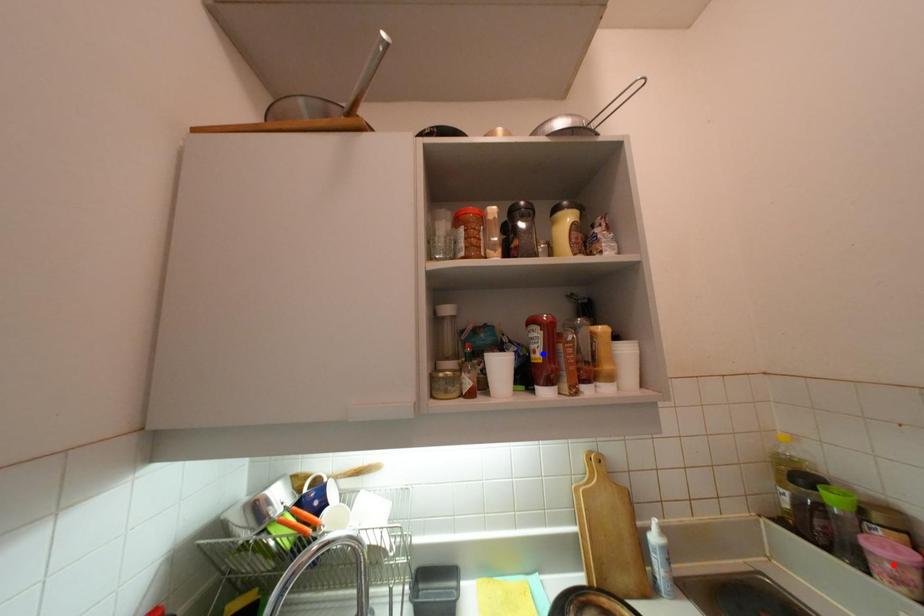
Question: In the image, two points are highlighted. Which point is nearer to the camera? Reply with the corresponding letter.

Choices:
 (A) blue point
 (B) red point

Answer: (B)